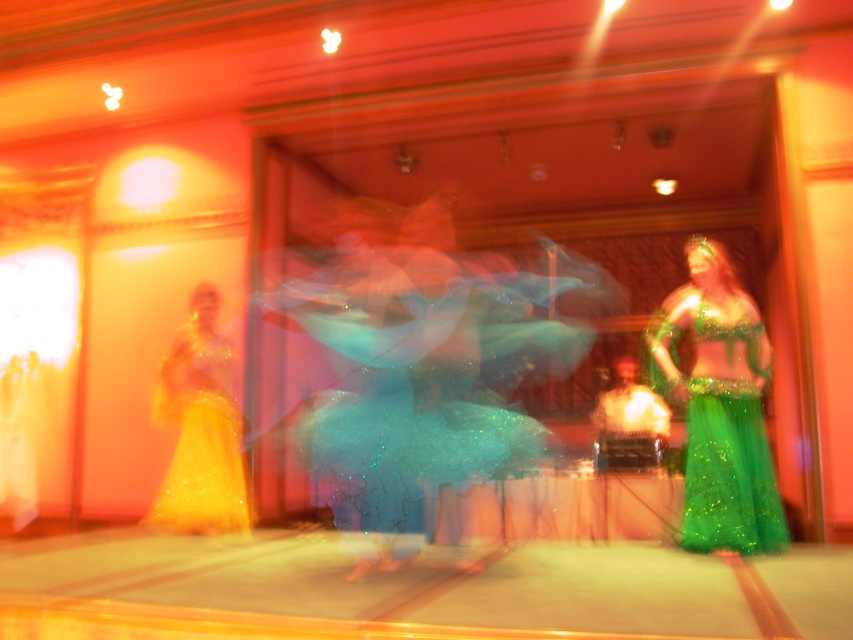
Is green glittery skirt at center bigger than shiny gold dress at left?

Indeed, green glittery skirt at center has a larger size compared to shiny gold dress at left.

Who is more forward, [718,432] or [206,428]?

Point [718,432] is in front.

I want to click on green glittery skirt at center, so click(x=721, y=410).